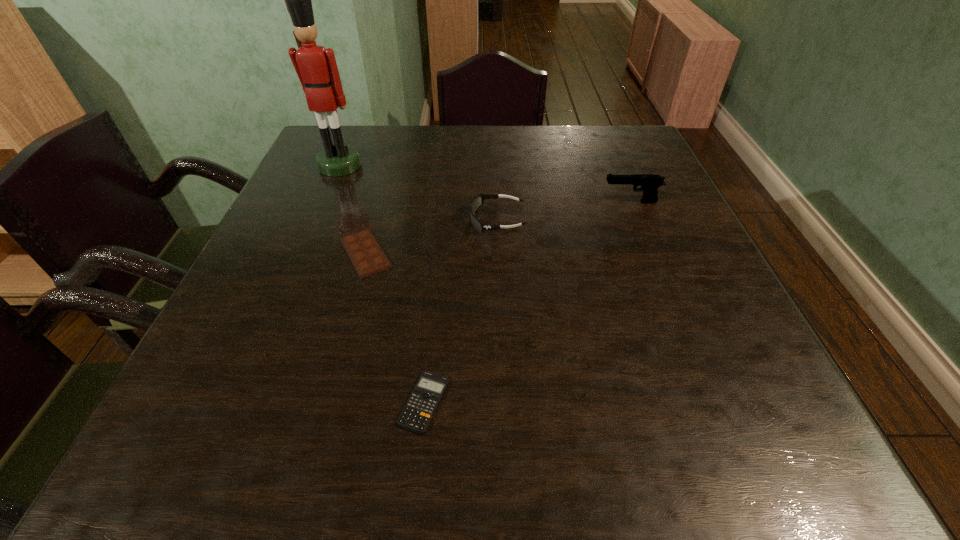
You are a GUI agent. You are given a task and a screenshot of the screen. Output one action in this format:
    pyautogui.click(x=<x>, y=<y>)
    Task: Click on the vacant space that satisfies the following two spatial constraints: 1. on the front side of the third object from left to right; 2. on the left side of the chocolate bar
    
    Given the screenshot: What is the action you would take?
    pyautogui.click(x=324, y=402)

You are a GUI agent. You are given a task and a screenshot of the screen. Output one action in this format:
    pyautogui.click(x=<x>, y=<y>)
    Task: Click on the vacant area that satisfies the following two spatial constraints: 1. on the front-facing side of the tallest object; 2. on the left side of the fourth tallest object
    This screenshot has width=960, height=540.
    Given the screenshot: What is the action you would take?
    pyautogui.click(x=302, y=253)

I want to click on free spot that satisfies the following two spatial constraints: 1. on the front-facing side of the fourth object from right to left; 2. on the right side of the tallest object, so click(x=302, y=253).